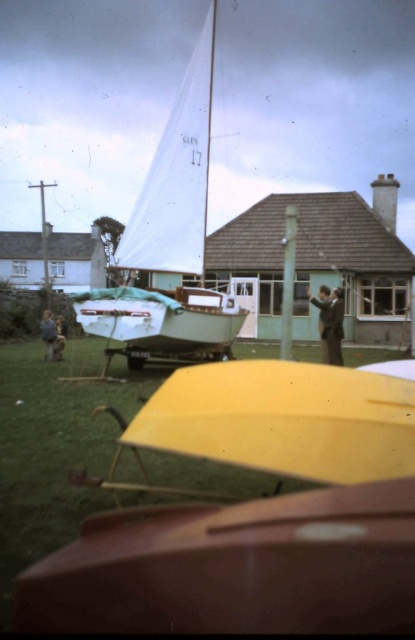
Question: Which object is the farthest from the brown leather jacket at lower left?

Choices:
 (A) dark brown leather jacket at center
 (B) white matte sailboat at center

Answer: (A)

Question: Is dark brown leather jacket at center wider than brown leather jacket at lower left?

Choices:
 (A) no
 (B) yes

Answer: (A)

Question: Among these objects, which one is nearest to the camera?

Choices:
 (A) brown leather jacket at lower left
 (B) dark brown leather jacket at center

Answer: (B)

Question: Is dark brown leather jacket at center above brown leather jacket at lower left?

Choices:
 (A) no
 (B) yes

Answer: (B)

Question: Observing the image, what is the correct spatial positioning of dark brown leather jacket at center in reference to brown leather jacket at lower left?

Choices:
 (A) right
 (B) left

Answer: (A)

Question: Among these points, which one is nearest to the camera?

Choices:
 (A) pos(117,257)
 (B) pos(58,348)

Answer: (A)